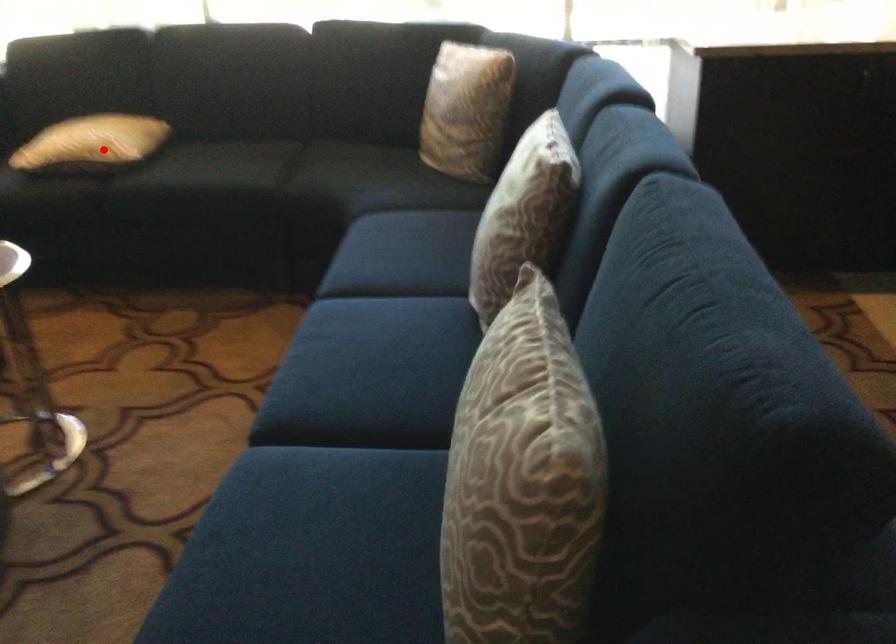
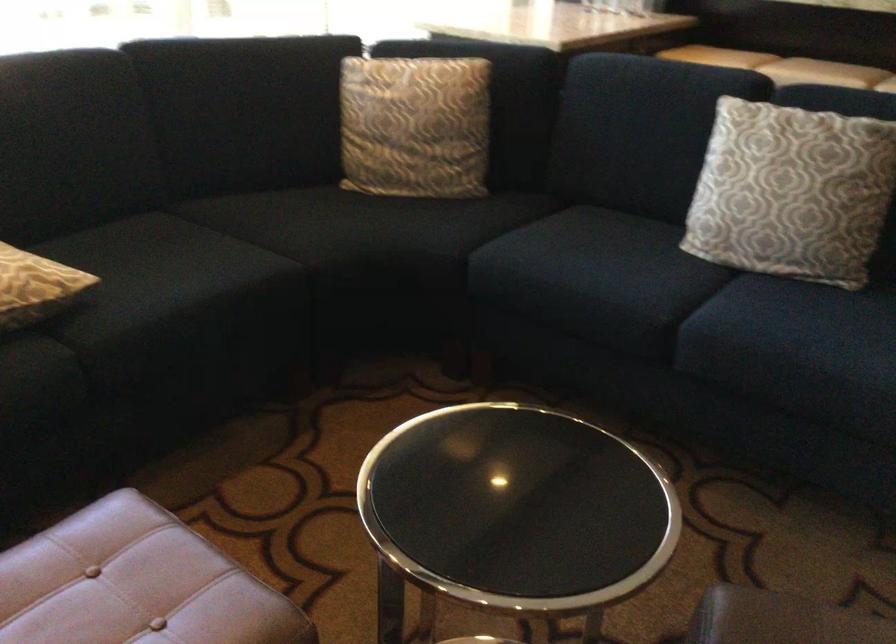
Find the pixel in the second image that matches the highlighted location in the first image.

(35, 287)